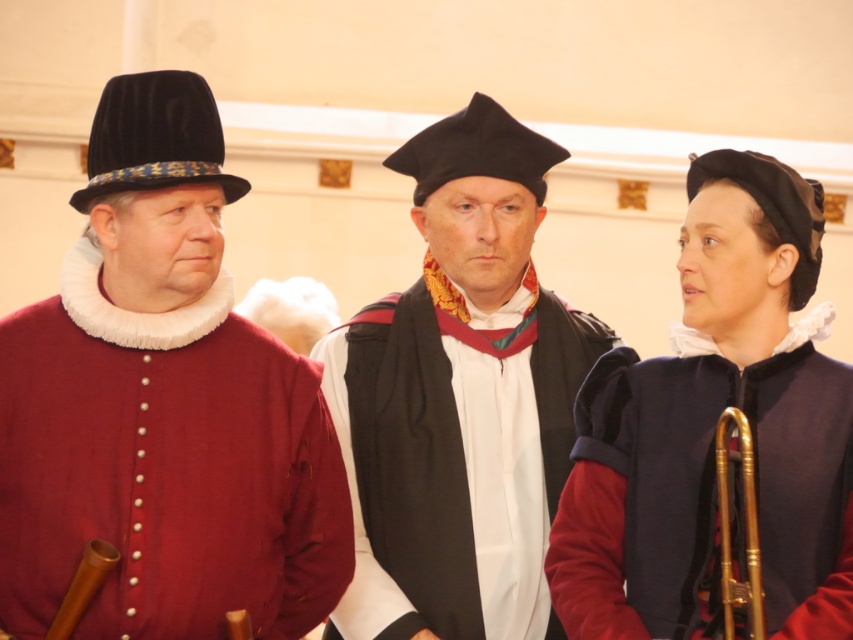
You are a guest at a historical event and see two people in the crowd. One is wearing a matte red coat at left, and the other is in a matte black gown at center. Which one is blocking the view of the other?

The matte red coat at left is positioned over the matte black gown at center, so it is blocking the view of the matte black gown at center.